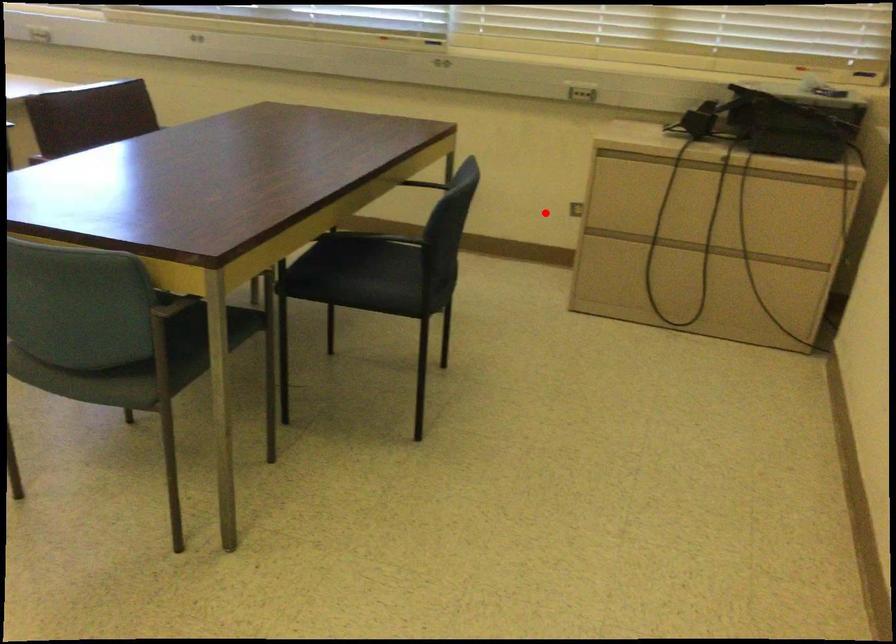
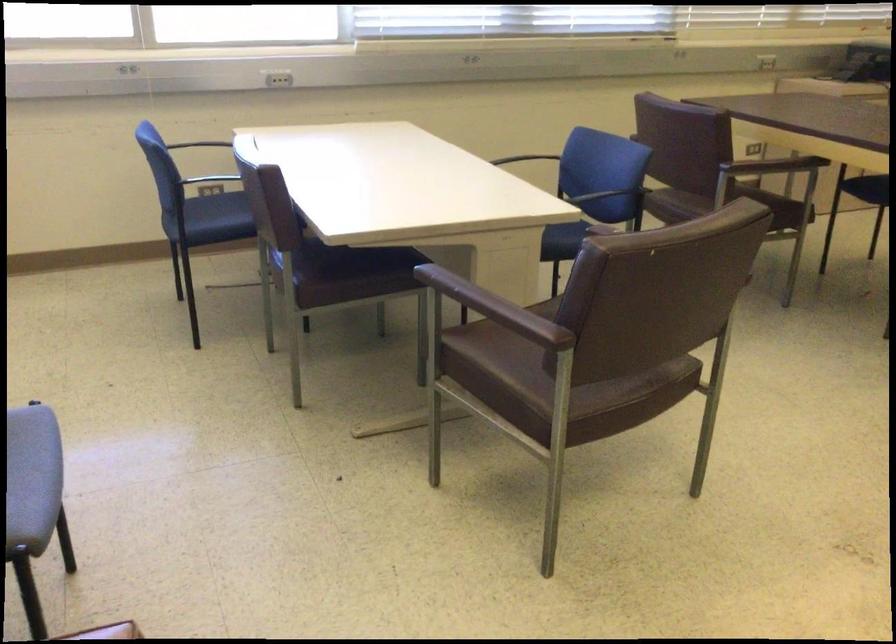
Locate, in the second image, the point that corresponds to the highlighted location in the first image.

(770, 152)